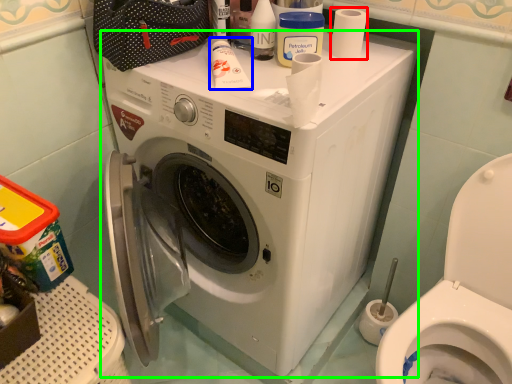
Question: Based on their relative distances, which object is nearer to toilet paper (highlighted by a red box)? Choose from toiletry (highlighted by a blue box) and washing machine (highlighted by a green box).

Choices:
 (A) toiletry
 (B) washing machine

Answer: (A)